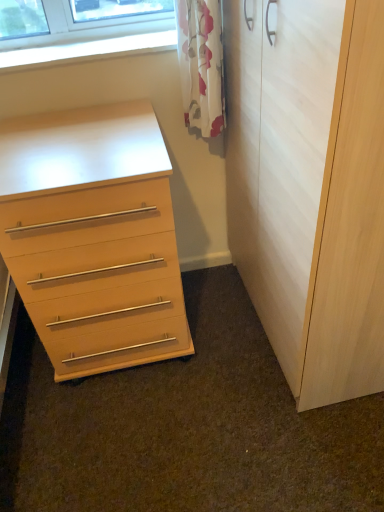
Question: From the image's perspective, is light wood/finish chest of drawers at left located above white floral curtain at upper center?

Choices:
 (A) no
 (B) yes

Answer: (A)

Question: Considering the relative positions of light wood/finish chest of drawers at left and white floral curtain at upper center in the image provided, is light wood/finish chest of drawers at left to the right of white floral curtain at upper center from the viewer's perspective?

Choices:
 (A) yes
 (B) no

Answer: (B)

Question: From a real-world perspective, is light wood/finish chest of drawers at left physically below white floral curtain at upper center?

Choices:
 (A) yes
 (B) no

Answer: (A)

Question: Is the depth of light wood/finish chest of drawers at left greater than that of white floral curtain at upper center?

Choices:
 (A) yes
 (B) no

Answer: (B)

Question: Does light wood/finish chest of drawers at left have a lesser height compared to white floral curtain at upper center?

Choices:
 (A) yes
 (B) no

Answer: (B)

Question: Based on their sizes in the image, would you say light wood/texture cupboard at right is bigger or smaller than white floral curtain at upper center?

Choices:
 (A) big
 (B) small

Answer: (A)

Question: Is light wood/texture cupboard at right wider or thinner than white floral curtain at upper center?

Choices:
 (A) thin
 (B) wide

Answer: (B)

Question: In terms of height, does light wood/texture cupboard at right look taller or shorter compared to white floral curtain at upper center?

Choices:
 (A) short
 (B) tall

Answer: (B)

Question: Is light wood/texture cupboard at right situated inside white floral curtain at upper center or outside?

Choices:
 (A) inside
 (B) outside

Answer: (B)

Question: Based on their positions, is light wood/texture cupboard at right located to the left or right of light wood/finish chest of drawers at left?

Choices:
 (A) right
 (B) left

Answer: (A)

Question: In terms of height, does light wood/texture cupboard at right look taller or shorter compared to light wood/finish chest of drawers at left?

Choices:
 (A) tall
 (B) short

Answer: (A)

Question: Is light wood/texture cupboard at right wider or thinner than light wood/finish chest of drawers at left?

Choices:
 (A) thin
 (B) wide

Answer: (A)

Question: From a real-world perspective, is light wood/texture cupboard at right above or below light wood/finish chest of drawers at left?

Choices:
 (A) below
 (B) above

Answer: (B)

Question: Looking at the image, does white floral curtain at upper center seem bigger or smaller compared to light wood/finish chest of drawers at left?

Choices:
 (A) small
 (B) big

Answer: (A)

Question: In terms of width, does white floral curtain at upper center look wider or thinner when compared to light wood/finish chest of drawers at left?

Choices:
 (A) thin
 (B) wide

Answer: (A)